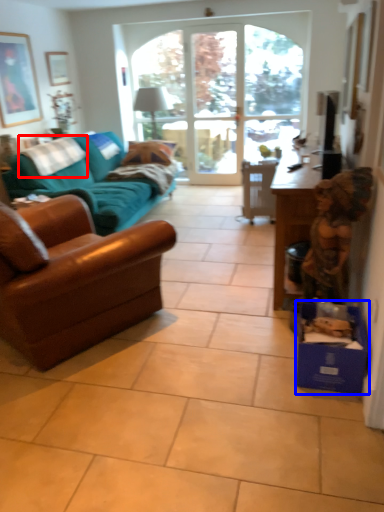
Question: Which point is further to the camera, pillow (highlighted by a red box) or cardboard box (highlighted by a blue box)?

Choices:
 (A) pillow
 (B) cardboard box

Answer: (A)